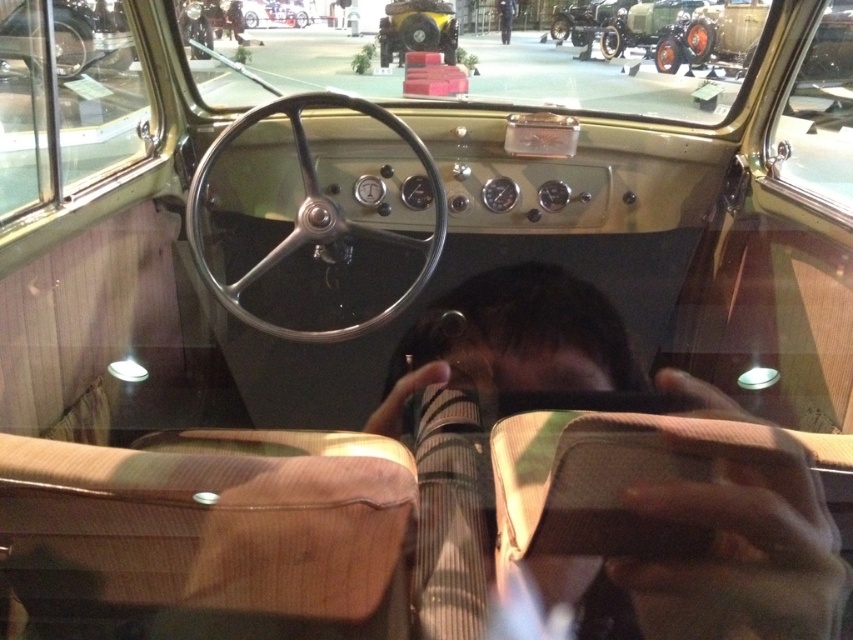
Question: Is dark brown leather jacket at center further to camera compared to black fabric pants at center?

Choices:
 (A) no
 (B) yes

Answer: (A)

Question: Among these objects, which one is nearest to the camera?

Choices:
 (A) black fabric pants at center
 (B) dark brown leather jacket at center

Answer: (B)

Question: Which object is farther from the camera taking this photo?

Choices:
 (A) black fabric pants at center
 (B) dark brown leather jacket at center

Answer: (A)

Question: Does dark brown leather jacket at center appear on the right side of black fabric pants at center?

Choices:
 (A) no
 (B) yes

Answer: (A)

Question: Among these objects, which one is farthest from the camera?

Choices:
 (A) black fabric pants at center
 (B) dark brown leather jacket at center

Answer: (A)

Question: Does dark brown leather jacket at center come in front of black fabric pants at center?

Choices:
 (A) yes
 (B) no

Answer: (A)